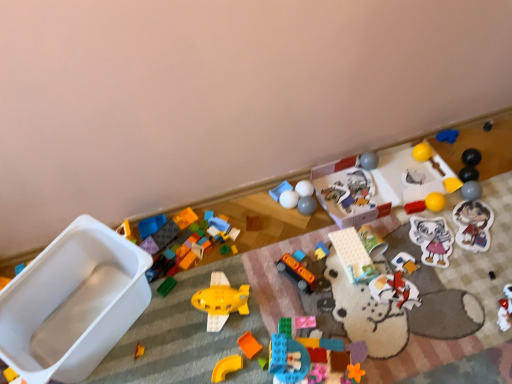
Where is `vacant location behind orange plastic block at lower left, acting as the 23th toy starting from the right`? The height and width of the screenshot is (384, 512). vacant location behind orange plastic block at lower left, acting as the 23th toy starting from the right is located at coordinates (155, 310).